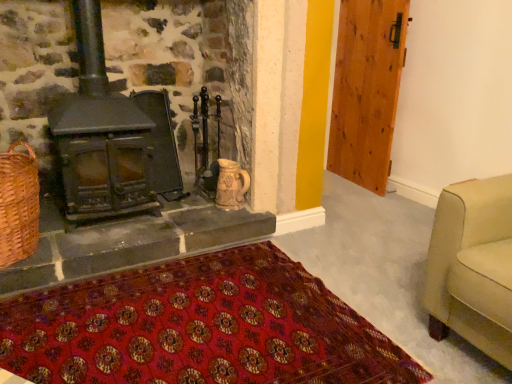
Question: Considering the relative positions of woven brown basket at lower left and red woven mat at lower center in the image provided, is woven brown basket at lower left to the left of red woven mat at lower center from the viewer's perspective?

Choices:
 (A) no
 (B) yes

Answer: (B)

Question: Is red woven mat at lower center at the back of woven brown basket at lower left?

Choices:
 (A) yes
 (B) no

Answer: (B)

Question: Are woven brown basket at lower left and red woven mat at lower center located far from each other?

Choices:
 (A) no
 (B) yes

Answer: (A)

Question: Can red woven mat at lower center be found inside woven brown basket at lower left?

Choices:
 (A) yes
 (B) no

Answer: (B)

Question: Does woven brown basket at lower left have a greater height compared to red woven mat at lower center?

Choices:
 (A) yes
 (B) no

Answer: (A)

Question: Is matte black wood burning stove at left taller or shorter than wooden door at right?

Choices:
 (A) tall
 (B) short

Answer: (B)

Question: In terms of width, does matte black wood burning stove at left look wider or thinner when compared to wooden door at right?

Choices:
 (A) wide
 (B) thin

Answer: (A)

Question: Relative to wooden door at right, is matte black wood burning stove at left in front or behind?

Choices:
 (A) behind
 (B) front

Answer: (B)

Question: From the image's perspective, is matte black wood burning stove at left above or below wooden door at right?

Choices:
 (A) below
 (B) above

Answer: (A)

Question: From a real-world perspective, is woven brown basket at lower left physically located above or below matte black wood burning stove at left?

Choices:
 (A) below
 (B) above

Answer: (A)

Question: Choose the correct answer: Is woven brown basket at lower left inside matte black wood burning stove at left or outside it?

Choices:
 (A) outside
 (B) inside

Answer: (A)

Question: In the image, is woven brown basket at lower left on the left side or the right side of matte black wood burning stove at left?

Choices:
 (A) right
 (B) left

Answer: (B)

Question: Considering the positions of woven brown basket at lower left and matte black wood burning stove at left in the image, is woven brown basket at lower left wider or thinner than matte black wood burning stove at left?

Choices:
 (A) thin
 (B) wide

Answer: (A)

Question: Is wooden door at right spatially inside woven brown basket at lower left, or outside of it?

Choices:
 (A) inside
 (B) outside

Answer: (B)

Question: In the image, is wooden door at right positioned in front of or behind woven brown basket at lower left?

Choices:
 (A) front
 (B) behind

Answer: (B)